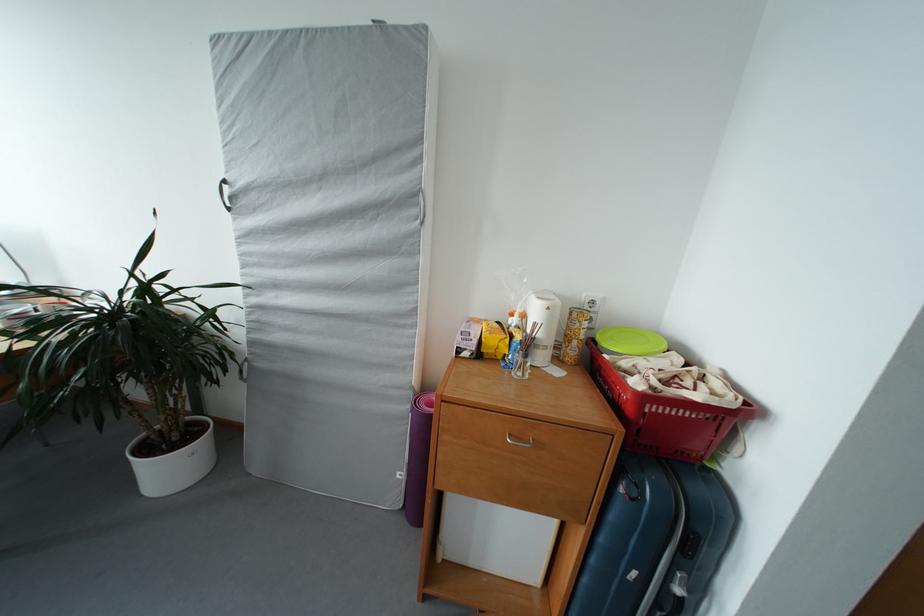
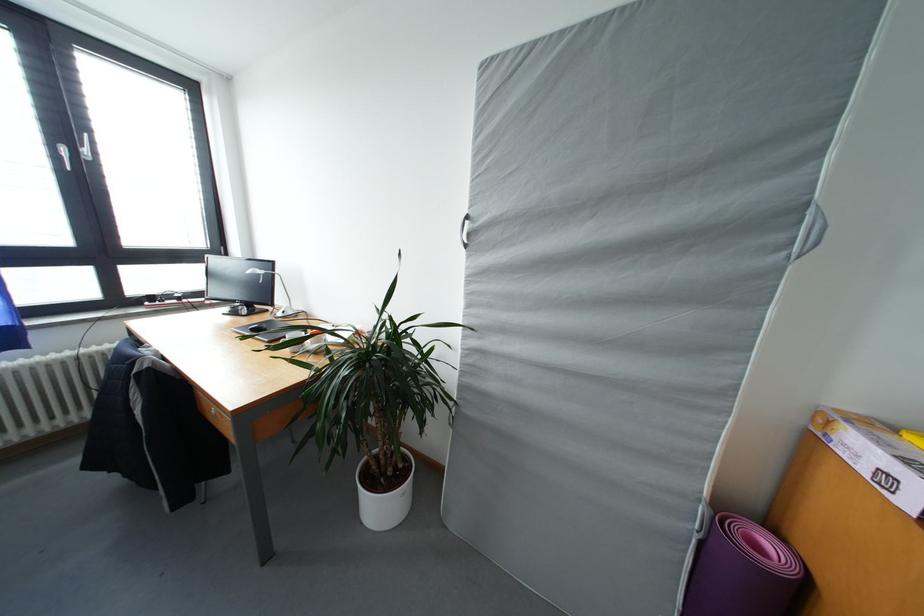
Question: The images are taken continuously from a first-person perspective. In which direction are you moving?

Choices:
 (A) Left
 (B) Right
 (C) Forward
 (D) Backward

Answer: (A)